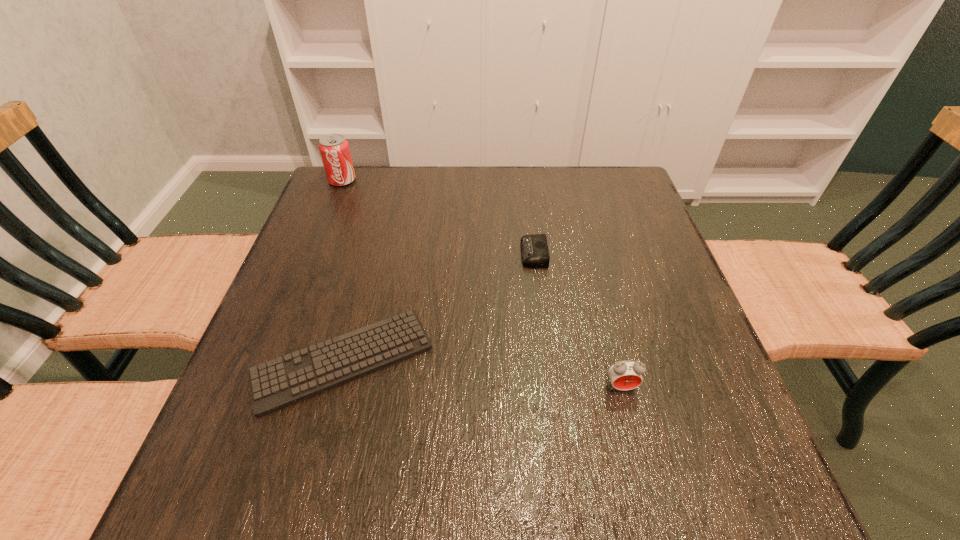
The image size is (960, 540). Identify the location of free space at the left edge of the desktop. (324, 298).

Locate an element on the screen. free space at the right edge is located at coordinates (635, 229).

Identify the location of vacant region at the near left corner of the desktop. (278, 500).

In the image, there is a desktop. Find the location of `vacant space at the far right corner`. vacant space at the far right corner is located at coordinates (632, 198).

This screenshot has width=960, height=540. What are the coordinates of `unoccupied area between the shortest object and the third shortest object` in the screenshot? It's located at (482, 374).

Find the location of `vacant space in between the farthest object and the computer keyboard`. vacant space in between the farthest object and the computer keyboard is located at coordinates (343, 271).

I want to click on free space between the right alarm clock and the computer keyboard, so click(482, 374).

Identify the location of free spot between the tallest object and the second tallest object. Image resolution: width=960 pixels, height=540 pixels. (482, 284).

The width and height of the screenshot is (960, 540). What are the coordinates of `free space between the third object from left to right and the tallest object` in the screenshot? It's located at (438, 217).

At what (x,y) coordinates should I click in order to perform the action: click on unoccupied position between the farthest object and the computer keyboard. Please return your answer as a coordinate pair (x, y). Looking at the image, I should click on [x=343, y=271].